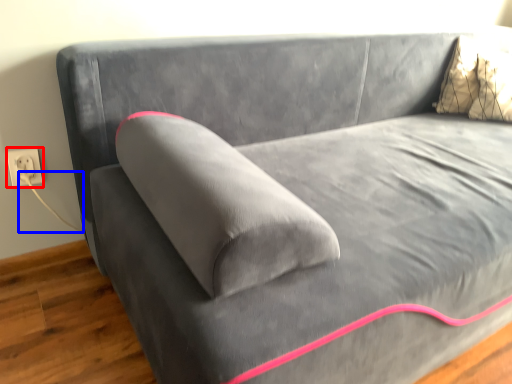
Question: Which object is closer to the camera taking this photo, electric outlet (highlighted by a red box) or string (highlighted by a blue box)?

Choices:
 (A) electric outlet
 (B) string

Answer: (B)